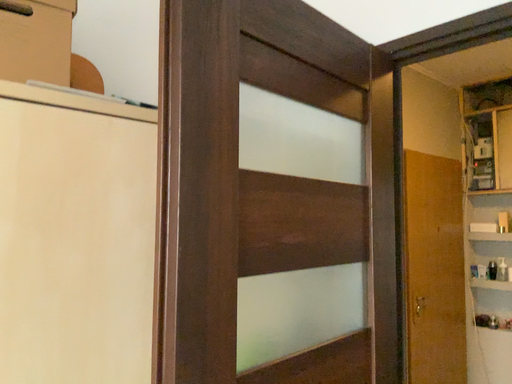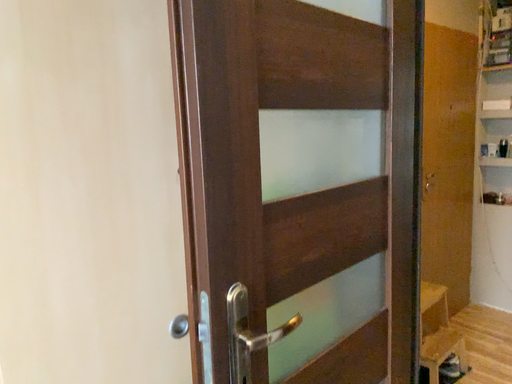
Question: How did the camera likely rotate when shooting the video?

Choices:
 (A) rotated upward
 (B) rotated downward

Answer: (B)